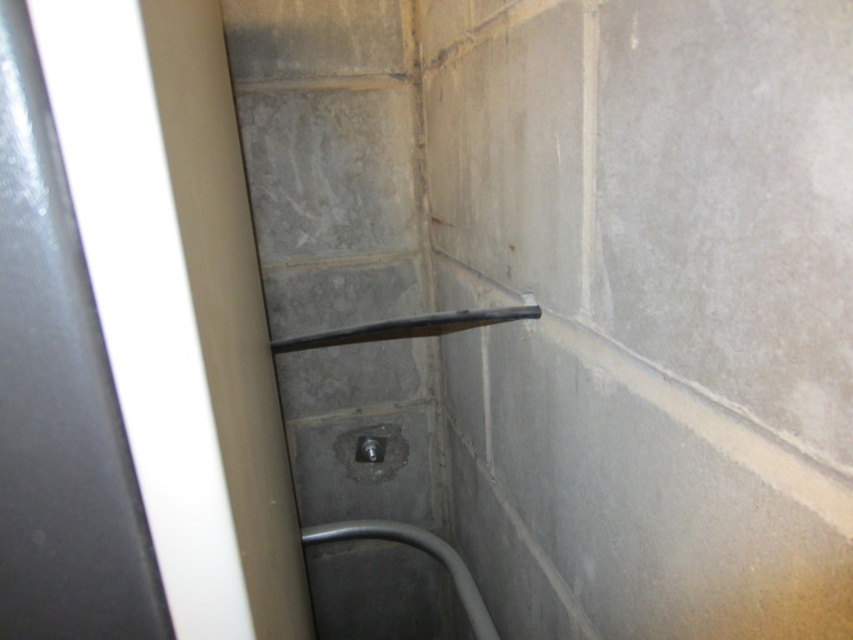
Question: Which object appears farthest from the camera in this image?

Choices:
 (A) black rubber shower at center
 (B) satin silver drain at center

Answer: (B)

Question: Does black rubber shower at center come in front of satin silver drain at center?

Choices:
 (A) yes
 (B) no

Answer: (A)

Question: Does black rubber shower at center come behind satin silver drain at center?

Choices:
 (A) yes
 (B) no

Answer: (B)

Question: Is black rubber shower at center further to the viewer compared to satin silver drain at center?

Choices:
 (A) no
 (B) yes

Answer: (A)

Question: Which of the following is the closest to the observer?

Choices:
 (A) black rubber shower at center
 (B) satin silver drain at center

Answer: (A)

Question: Which of the following is the closest to the observer?

Choices:
 (A) (397, 468)
 (B) (468, 314)

Answer: (B)